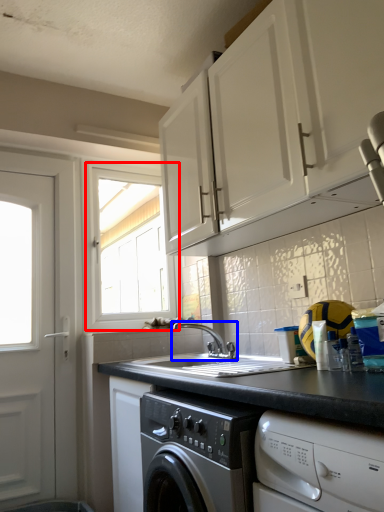
Question: Which point is closer to the camera, window (highlighted by a red box) or tap (highlighted by a blue box)?

Choices:
 (A) window
 (B) tap

Answer: (B)